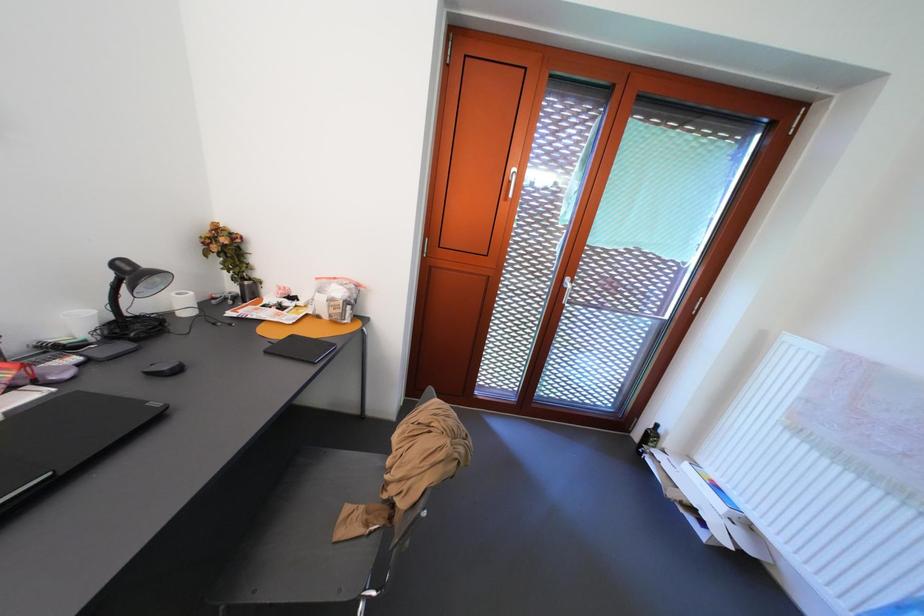
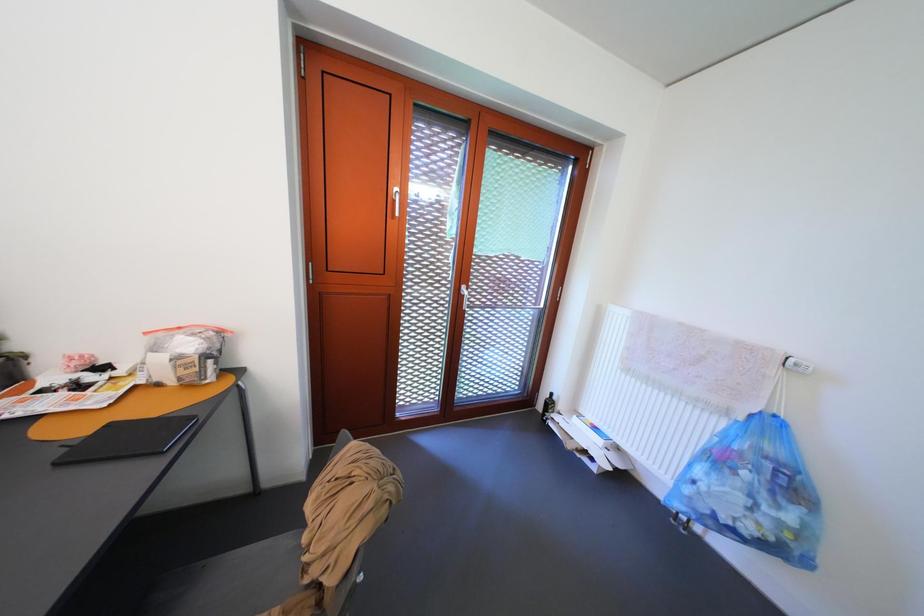
Which direction would the cameraman need to move to produce the second image?

The movement direction of the cameraman is right, backward.